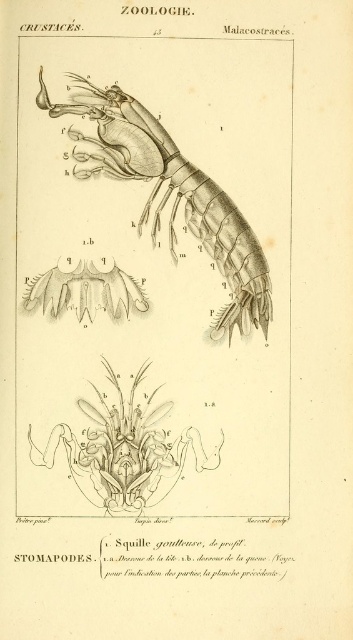
In the zoological illustration of the stomatopod, there are two points labeled with coordinates. From the viewer perspective, which point is closer to you? The points are point (93, 140) and point (82, 440).

Point (93, 140) is in front of point (82, 440), so it is closer to the viewer.